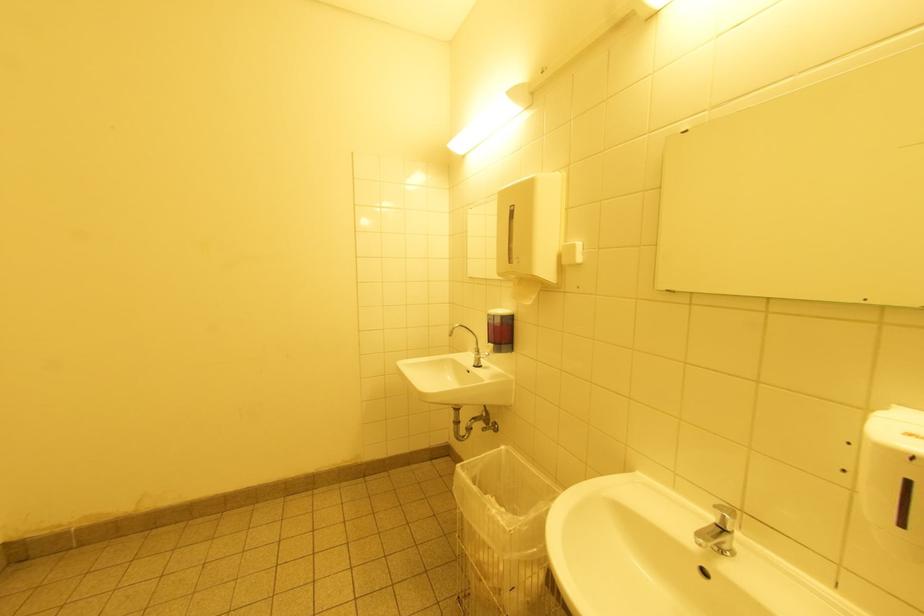
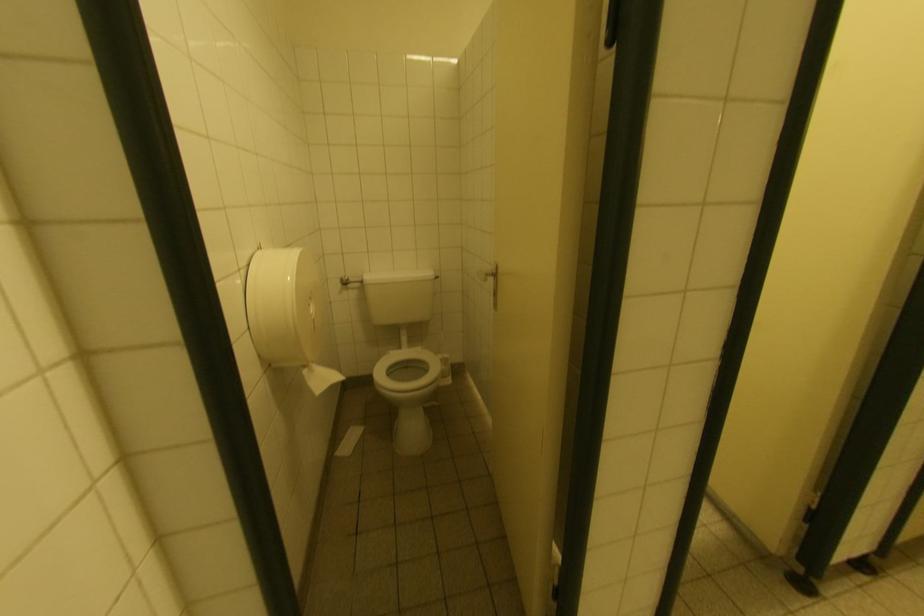
What movement of the cameraman would produce the second image?

The movement direction of the cameraman is left, backward.